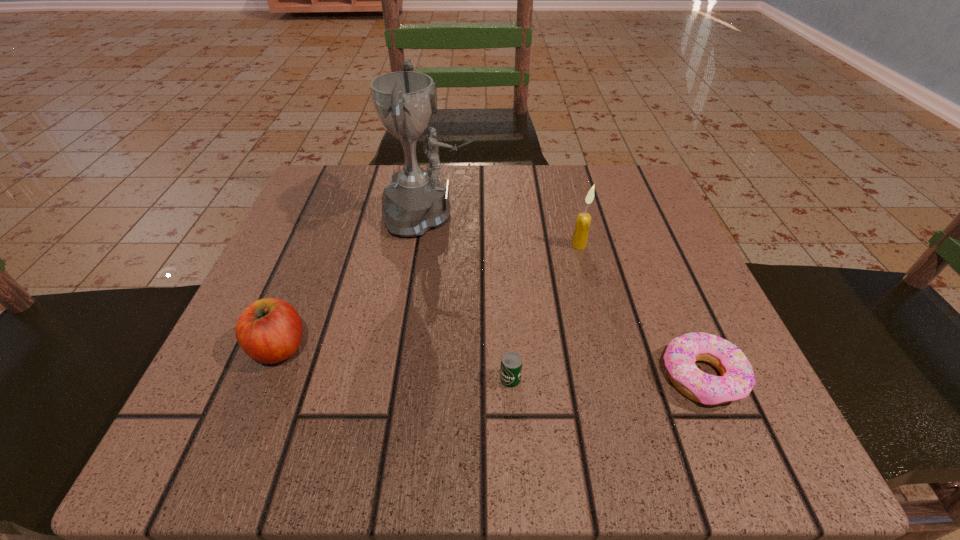
In the image, there is a desktop. Find the location of `free space at the near edge`. free space at the near edge is located at coordinates (510, 401).

I want to click on free space at the left edge of the desktop, so click(338, 341).

In the image, there is a desktop. Where is `vacant space at the right edge`? The image size is (960, 540). vacant space at the right edge is located at coordinates (606, 237).

The width and height of the screenshot is (960, 540). Find the location of `blank space at the far left corner`. blank space at the far left corner is located at coordinates (340, 206).

You are a GUI agent. You are given a task and a screenshot of the screen. Output one action in this format:
    pyautogui.click(x=<x>, y=<y>)
    Task: Click on the vacant space at the far right corner
    
    Given the screenshot: What is the action you would take?
    pyautogui.click(x=586, y=201)

Where is `empty space that is in between the doughnut and the candle`? empty space that is in between the doughnut and the candle is located at coordinates [640, 311].

You are a GUI agent. You are given a task and a screenshot of the screen. Output one action in this format:
    pyautogui.click(x=<x>, y=<y>)
    Task: Click on the free spot between the doughnut and the apple
    The height and width of the screenshot is (540, 960).
    Given the screenshot: What is the action you would take?
    pyautogui.click(x=491, y=362)

Identify the location of blank region between the third tallest object and the second object from right to left. Image resolution: width=960 pixels, height=540 pixels. (429, 296).

Identify the location of free space that is in between the fourth shortest object and the third object from right to left. This screenshot has height=540, width=960. (544, 312).

Where is `free point between the second tallest object and the tallest object`? free point between the second tallest object and the tallest object is located at coordinates (505, 231).